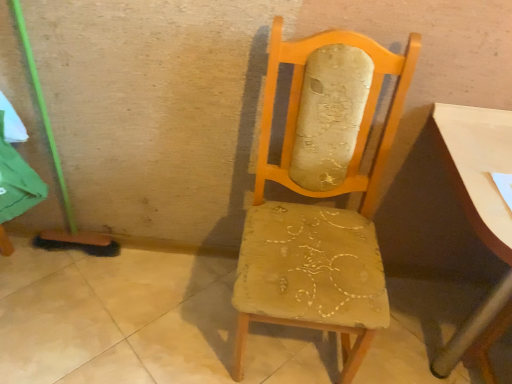
Question: From the image's perspective, is wooden upholstered chair at center above or below smooth white table at right?

Choices:
 (A) above
 (B) below

Answer: (A)

Question: Looking at the image, does wooden upholstered chair at center seem bigger or smaller compared to smooth white table at right?

Choices:
 (A) big
 (B) small

Answer: (B)

Question: In the image, is wooden upholstered chair at center on the left side or the right side of smooth white table at right?

Choices:
 (A) right
 (B) left

Answer: (B)

Question: Is smooth white table at right inside the boundaries of wooden upholstered chair at center, or outside?

Choices:
 (A) inside
 (B) outside

Answer: (B)

Question: Is smooth white table at right wider or thinner than wooden upholstered chair at center?

Choices:
 (A) wide
 (B) thin

Answer: (A)

Question: Is smooth white table at right in front of or behind wooden upholstered chair at center in the image?

Choices:
 (A) behind
 (B) front

Answer: (A)

Question: Is point (492, 195) closer or farther from the camera than point (386, 152)?

Choices:
 (A) closer
 (B) farther

Answer: (A)